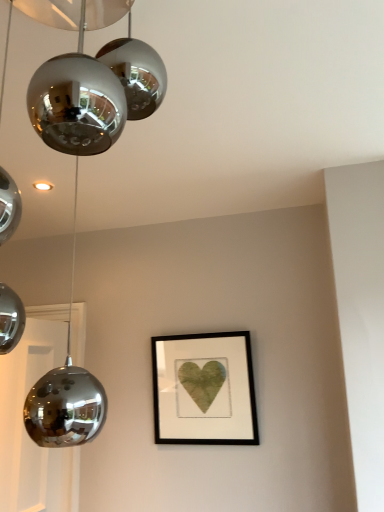
Question: Is matte black frame at center oriented away from polished chrome globe at upper left?

Choices:
 (A) yes
 (B) no

Answer: (B)

Question: Can you confirm if matte black frame at center is taller than polished chrome globe at upper left?

Choices:
 (A) no
 (B) yes

Answer: (A)

Question: Can you confirm if matte black frame at center is thinner than polished chrome globe at upper left?

Choices:
 (A) yes
 (B) no

Answer: (A)

Question: Is matte black frame at center oriented towards polished chrome globe at upper left?

Choices:
 (A) no
 (B) yes

Answer: (B)

Question: Is matte black frame at center located outside polished chrome globe at upper left?

Choices:
 (A) yes
 (B) no

Answer: (A)

Question: Is matte black frame at center wider than polished chrome globe at upper left?

Choices:
 (A) no
 (B) yes

Answer: (A)

Question: Is polished chrome globe at upper left beside matte black frame at center?

Choices:
 (A) yes
 (B) no

Answer: (B)

Question: Considering the relative sizes of polished chrome globe at upper left and matte black frame at center in the image provided, is polished chrome globe at upper left taller than matte black frame at center?

Choices:
 (A) no
 (B) yes

Answer: (B)

Question: Is polished chrome globe at upper left bigger than matte black frame at center?

Choices:
 (A) no
 (B) yes

Answer: (B)

Question: Can you confirm if polished chrome globe at upper left is smaller than matte black frame at center?

Choices:
 (A) yes
 (B) no

Answer: (B)

Question: From a real-world perspective, is polished chrome globe at upper left on matte black frame at center?

Choices:
 (A) yes
 (B) no

Answer: (A)

Question: From the image's perspective, is polished chrome globe at upper left located beneath matte black frame at center?

Choices:
 (A) no
 (B) yes

Answer: (A)

Question: Would you say polished chrome globe at upper left is inside or outside matte black frame at center?

Choices:
 (A) inside
 (B) outside

Answer: (B)